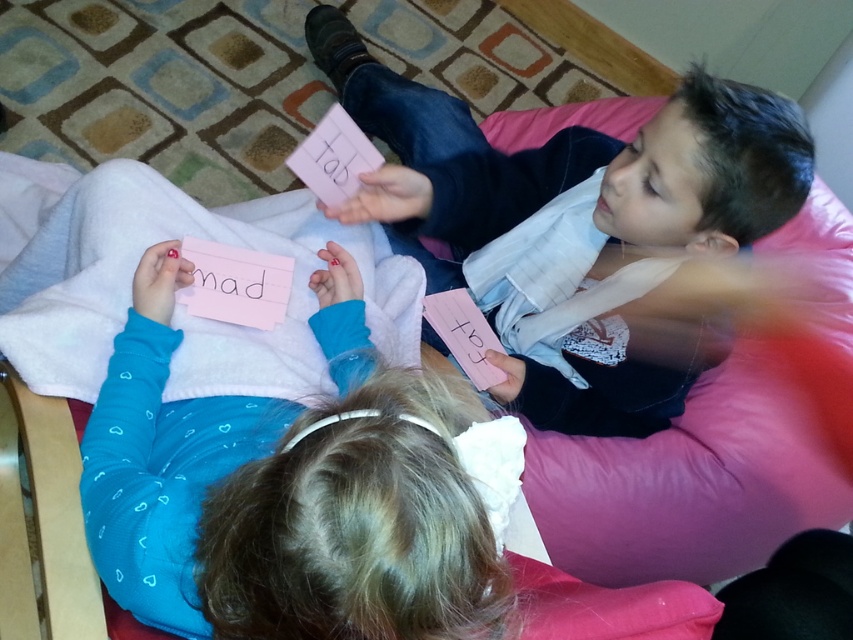
The image size is (853, 640). Describe the element at coordinates (287, 490) in the screenshot. I see `pink paper card at center` at that location.

You are a GUI agent. You are given a task and a screenshot of the screen. Output one action in this format:
    pyautogui.click(x=<x>, y=<y>)
    Task: Click on the pink paper card at center
    
    Given the screenshot: What is the action you would take?
    pyautogui.click(x=287, y=490)

What are the coordinates of `pink paper card at center` in the screenshot? It's located at (287, 490).